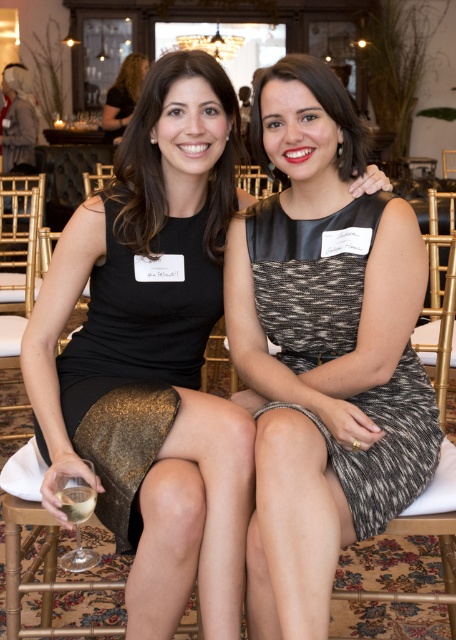
Is clear glass wine glass at lower left behind matte black dress at center?

No, clear glass wine glass at lower left is closer to the viewer.

Between clear glass wine glass at lower left and matte black dress at center, which one is positioned lower?

clear glass wine glass at lower left

The width and height of the screenshot is (456, 640). Identify the location of clear glass wine glass at lower left. (76, 518).

Is black leather dress at left smaller than matte black dress at center?

Correct, black leather dress at left occupies less space than matte black dress at center.

How much distance is there between black leather dress at left and matte black dress at center?

The distance of black leather dress at left from matte black dress at center is 6.02 meters.

Who is more forward, (92, 408) or (141, 80)?

Point (92, 408) is more forward.

This screenshot has width=456, height=640. What are the coordinates of `black leather dress at left` in the screenshot? It's located at (135, 362).

Is speckled jersey dress at center smaller than clear glass wine glass at lower left?

No, speckled jersey dress at center is not smaller than clear glass wine glass at lower left.

Can you confirm if speckled jersey dress at center is taller than clear glass wine glass at lower left?

Correct, speckled jersey dress at center is much taller as clear glass wine glass at lower left.

Does point (423, 484) lie in front of point (70, 552)?

Yes, point (423, 484) is in front of point (70, 552).

This screenshot has height=640, width=456. I want to click on speckled jersey dress at center, so click(310, 276).